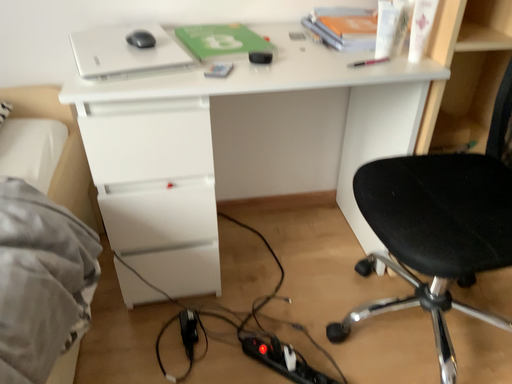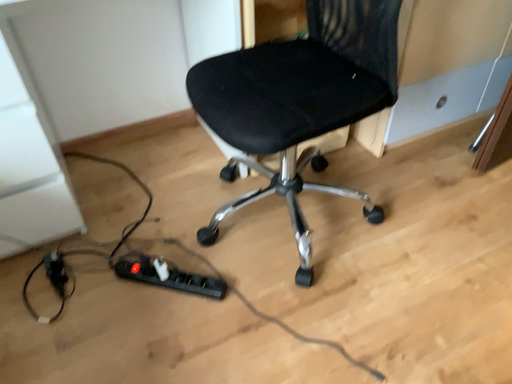
Question: Which way did the camera rotate in the video?

Choices:
 (A) rotated downward
 (B) rotated upward

Answer: (A)